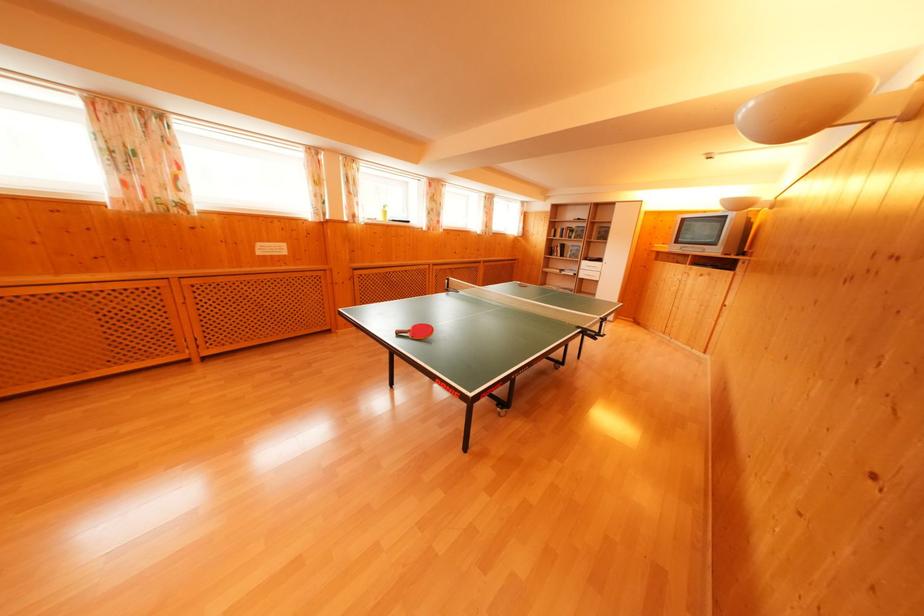
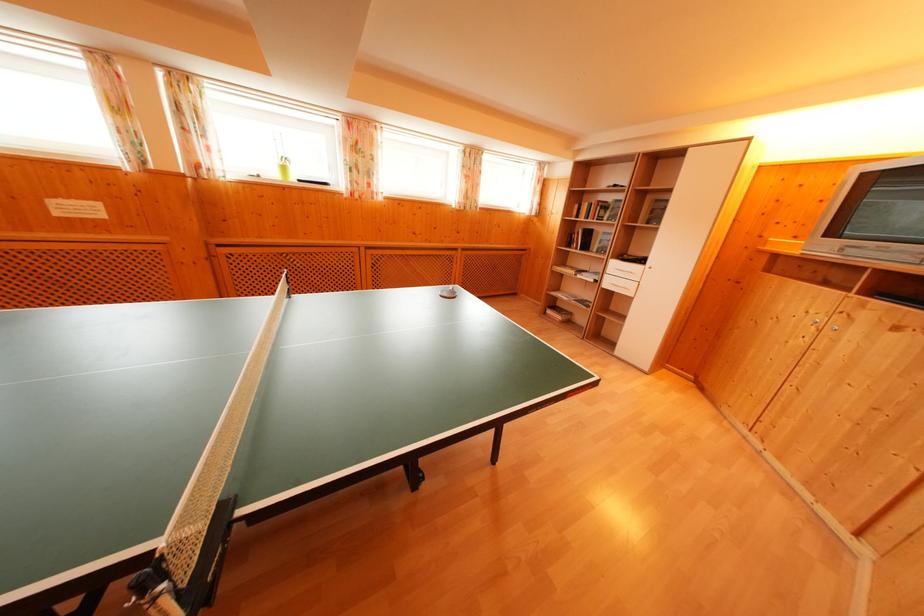
The point at (587, 273) is marked in the first image. Where is the corresponding point in the second image?

(614, 276)